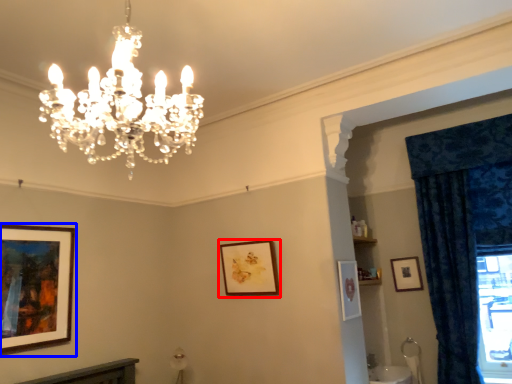
Question: Among these objects, which one is nearest to the camera, picture frame (highlighted by a red box) or picture frame (highlighted by a blue box)?

Choices:
 (A) picture frame
 (B) picture frame

Answer: (B)